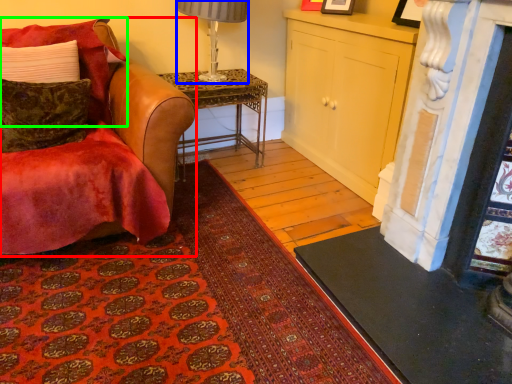
Question: Which is farther away from chair (highlighted by a red box)? lamp (highlighted by a blue box) or pillow (highlighted by a green box)?

Choices:
 (A) lamp
 (B) pillow

Answer: (A)